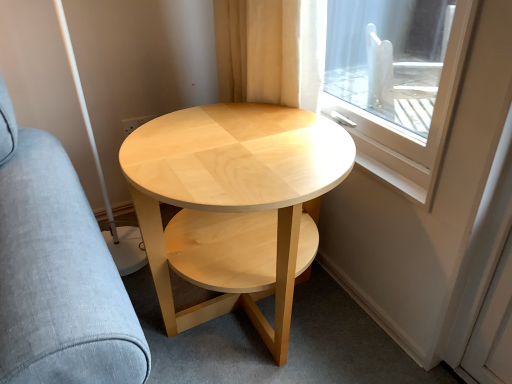
What is the approximate height of light gray fabric swivel chair at left?

It is 38.00 inches.

The width and height of the screenshot is (512, 384). What do you see at coordinates (57, 272) in the screenshot? I see `light gray fabric swivel chair at left` at bounding box center [57, 272].

The width and height of the screenshot is (512, 384). Find the location of `light gray fabric swivel chair at left`. light gray fabric swivel chair at left is located at coordinates (57, 272).

In order to click on natural wood coffee table at center in this screenshot , I will do `click(234, 192)`.

Measure the distance between natural wood coffee table at center and camera.

34.03 inches.

Describe the element at coordinates (234, 192) in the screenshot. This screenshot has height=384, width=512. I see `natural wood coffee table at center` at that location.

Find the location of a particular element. light gray fabric swivel chair at left is located at coordinates (57, 272).

Can you confirm if light gray fabric swivel chair at left is positioned to the left of natural wood coffee table at center?

Yes, light gray fabric swivel chair at left is to the left of natural wood coffee table at center.

Does light gray fabric swivel chair at left come behind natural wood coffee table at center?

That is False.

Is point (20, 264) in front of point (195, 161)?

Yes, it is.

From the image's perspective, between light gray fabric swivel chair at left and natural wood coffee table at center, which one is located above?

light gray fabric swivel chair at left.

From a real-world perspective, is light gray fabric swivel chair at left positioned over natural wood coffee table at center based on gravity?

Indeed, from a real-world perspective, light gray fabric swivel chair at left stands above natural wood coffee table at center.

Can you confirm if light gray fabric swivel chair at left is wider than natural wood coffee table at center?

Yes.

Can you confirm if light gray fabric swivel chair at left is taller than natural wood coffee table at center?

Yes, light gray fabric swivel chair at left is taller than natural wood coffee table at center.

Does light gray fabric swivel chair at left have a larger size compared to natural wood coffee table at center?

Correct, light gray fabric swivel chair at left is larger in size than natural wood coffee table at center.

Choose the correct answer: Is light gray fabric swivel chair at left inside natural wood coffee table at center or outside it?

light gray fabric swivel chair at left cannot be found inside natural wood coffee table at center.

Is there a large distance between light gray fabric swivel chair at left and natural wood coffee table at center?

No.

Could you tell me if light gray fabric swivel chair at left is facing natural wood coffee table at center?

No, light gray fabric swivel chair at left is not facing towards natural wood coffee table at center.

This screenshot has height=384, width=512. Identify the location of coffee table below the light gray fabric swivel chair at left (from a real-world perspective). (234, 192).

Between natural wood coffee table at center and light gray fabric swivel chair at left, which one appears on the left side from the viewer's perspective?

light gray fabric swivel chair at left is more to the left.

Is the position of natural wood coffee table at center less distant than that of light gray fabric swivel chair at left?

No, it is behind light gray fabric swivel chair at left.

Considering the positions of point (205, 203) and point (19, 321), is point (205, 203) closer or farther from the camera than point (19, 321)?

Point (205, 203) is positioned farther from the camera compared to point (19, 321).

From the image's perspective, is natural wood coffee table at center above light gray fabric swivel chair at left?

Actually, natural wood coffee table at center appears below light gray fabric swivel chair at left in the image.

From a real-world perspective, does natural wood coffee table at center stand above light gray fabric swivel chair at left?

No.

Considering the sizes of objects natural wood coffee table at center and light gray fabric swivel chair at left in the image provided, who is thinner, natural wood coffee table at center or light gray fabric swivel chair at left?

natural wood coffee table at center.

Considering the relative sizes of natural wood coffee table at center and light gray fabric swivel chair at left in the image provided, is natural wood coffee table at center taller than light gray fabric swivel chair at left?

No.

Does natural wood coffee table at center have a larger size compared to light gray fabric swivel chair at left?

No, natural wood coffee table at center is not bigger than light gray fabric swivel chair at left.

Is light gray fabric swivel chair at left a part of natural wood coffee table at center?

No.

Are natural wood coffee table at center and light gray fabric swivel chair at left beside each other?

natural wood coffee table at center and light gray fabric swivel chair at left are not in contact.

Could you tell me if natural wood coffee table at center is turned towards light gray fabric swivel chair at left?

No.

Can you tell me how much natural wood coffee table at center and light gray fabric swivel chair at left differ in facing direction?

natural wood coffee table at center and light gray fabric swivel chair at left are facing 49.1 degrees away from each other.

How distant is natural wood coffee table at center from light gray fabric swivel chair at left?

natural wood coffee table at center and light gray fabric swivel chair at left are 14.25 inches apart from each other.

You are a GUI agent. You are given a task and a screenshot of the screen. Output one action in this format:
    pyautogui.click(x=<x>, y=<y>)
    Task: Click on the coffee table that is under the light gray fabric swivel chair at left (from a real-world perspective)
    The height and width of the screenshot is (384, 512).
    Given the screenshot: What is the action you would take?
    pyautogui.click(x=234, y=192)

Find the location of a particular element. This screenshot has height=384, width=512. coffee table behind the light gray fabric swivel chair at left is located at coordinates (234, 192).

Find the location of a particular element. The width and height of the screenshot is (512, 384). coffee table that is under the light gray fabric swivel chair at left (from a real-world perspective) is located at coordinates (234, 192).